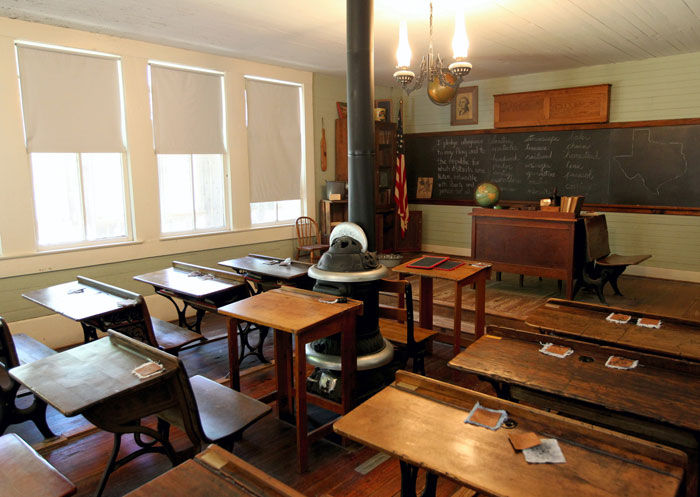
The height and width of the screenshot is (497, 700). I want to click on wall, so click(x=325, y=97).